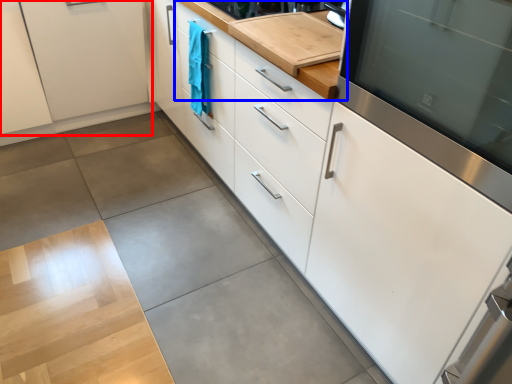
Question: Which object is further to the camera taking this photo, cabinetry (highlighted by a red box) or countertop (highlighted by a blue box)?

Choices:
 (A) cabinetry
 (B) countertop

Answer: (A)